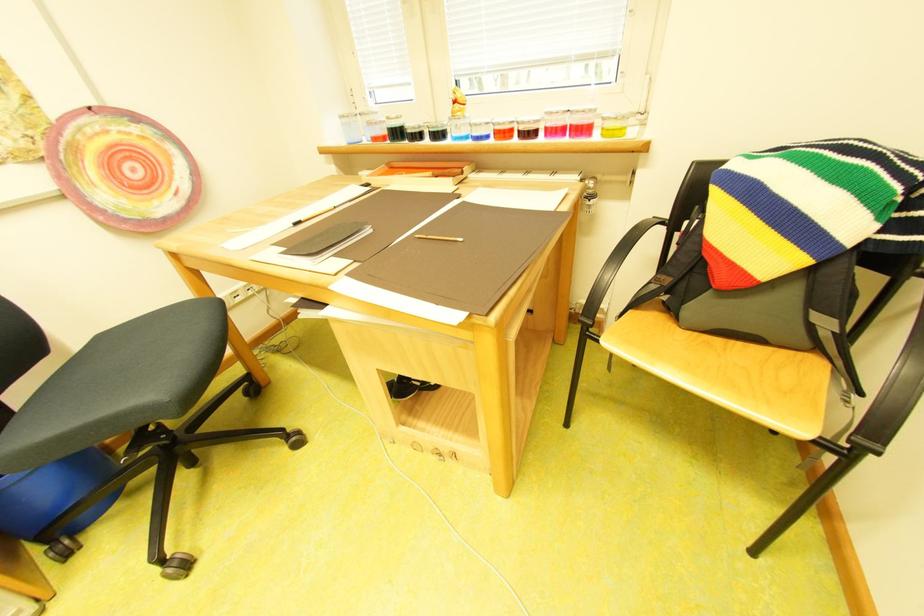
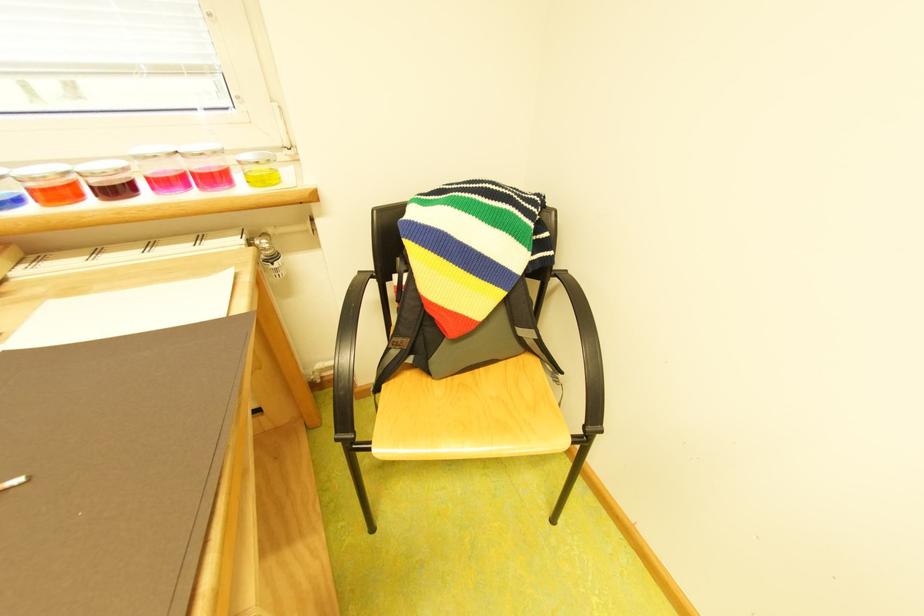
Question: The first image is from the beginning of the video and the second image is from the end. How did the camera likely rotate when shooting the video?

Choices:
 (A) Left
 (B) Right
 (C) Up
 (D) Down

Answer: (B)